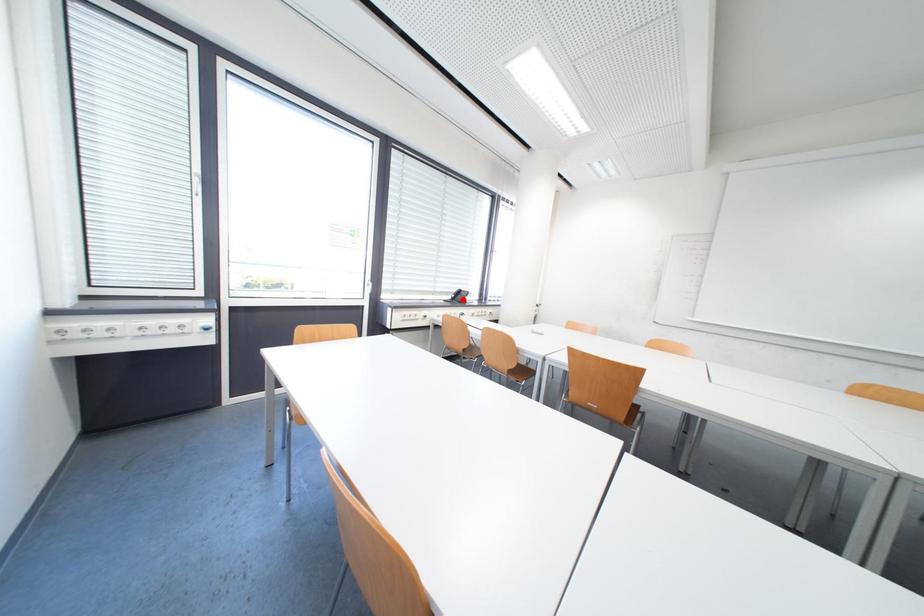
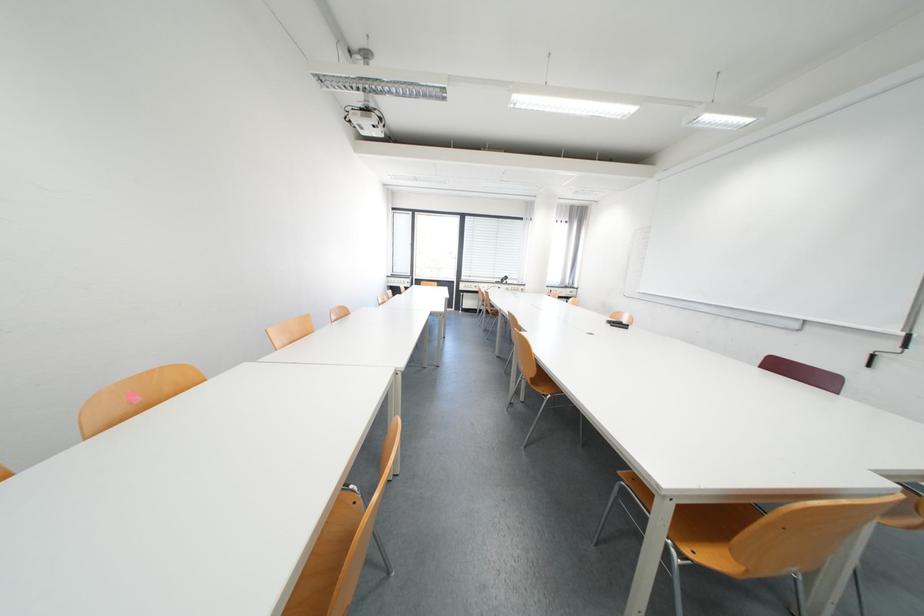
Where in the second image is the point corresponding to the highlighted location from the first image?

(512, 282)